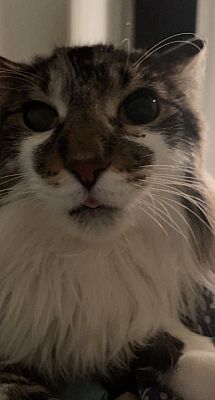
You are a GUI agent. You are given a task and a screenshot of the screen. Output one action in this format:
    pyautogui.click(x=<x>, y=<y>)
    Task: Click on the white chest
    The width and height of the screenshot is (215, 400).
    Given the screenshot: What is the action you would take?
    tap(85, 314)